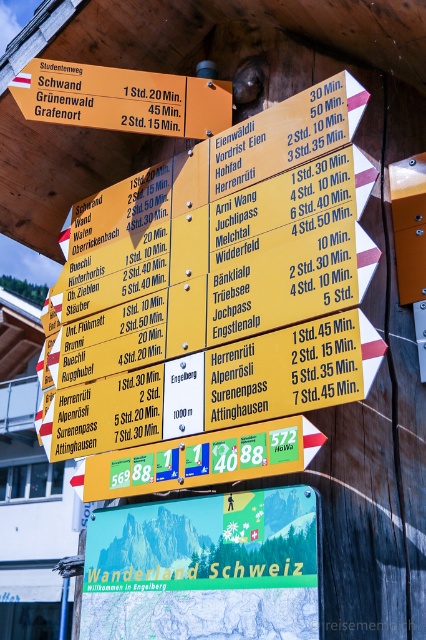
Question: Is green matte sign at center positioned behind yellow wood sign at upper center?

Choices:
 (A) yes
 (B) no

Answer: (B)

Question: Which point is closer to the camera?

Choices:
 (A) (180, 104)
 (B) (241, 596)

Answer: (B)

Question: Does green matte sign at center have a larger size compared to yellow wood sign at upper center?

Choices:
 (A) no
 (B) yes

Answer: (B)

Question: Which point is farther to the camera?

Choices:
 (A) (218, 580)
 (B) (230, 104)

Answer: (B)

Question: Can you confirm if green matte sign at center is positioned to the left of yellow wood sign at upper center?

Choices:
 (A) no
 (B) yes

Answer: (A)